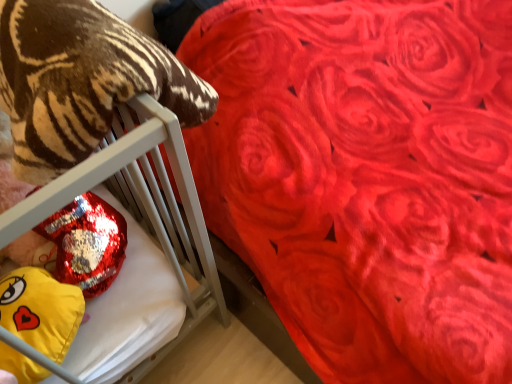
The width and height of the screenshot is (512, 384). What do you see at coordinates (41, 310) in the screenshot?
I see `yellow plush at left` at bounding box center [41, 310].

Describe the element at coordinates (143, 210) in the screenshot. The width and height of the screenshot is (512, 384). I see `shiny metallic pillow at left` at that location.

Find the location of a particular element. The width and height of the screenshot is (512, 384). shiny metallic pillow at left is located at coordinates point(143,210).

Measure the distance between point (188, 126) and camera.

The distance of point (188, 126) from camera is 34.29 inches.

The height and width of the screenshot is (384, 512). What are the coordinates of `yellow plush at left` in the screenshot? It's located at (41, 310).

Is point (49, 175) positioned in front of point (50, 278)?

Yes, point (49, 175) is in front of point (50, 278).

What's the angular difference between soft plush tiger at left and yellow plush at left's facing directions?

The angular difference between soft plush tiger at left and yellow plush at left is 1.88 degrees.

Which of these two, soft plush tiger at left or yellow plush at left, is smaller?

yellow plush at left is smaller.

Which object is further away from the camera taking this photo, soft plush tiger at left or yellow plush at left?

Positioned behind is yellow plush at left.

Considering the relative sizes of yellow plush at left and soft plush tiger at left in the image provided, is yellow plush at left bigger than soft plush tiger at left?

Actually, yellow plush at left might be smaller than soft plush tiger at left.

Is yellow plush at left wider or thinner than soft plush tiger at left?

In the image, yellow plush at left appears to be more narrow than soft plush tiger at left.

Based on the photo, considering the sizes of yellow plush at left and soft plush tiger at left in the image, is yellow plush at left taller or shorter than soft plush tiger at left?

Clearly, yellow plush at left is shorter compared to soft plush tiger at left.

Would you say yellow plush at left is inside or outside soft plush tiger at left?

yellow plush at left is not inside soft plush tiger at left, it's outside.

Between yellow plush at left and shiny metallic pillow at left, which one appears on the left side from the viewer's perspective?

Positioned to the left is shiny metallic pillow at left.

From a real-world perspective, is yellow plush at left beneath shiny metallic pillow at left?

Actually, yellow plush at left is physically above shiny metallic pillow at left in the real world.

Which object is wider, yellow plush at left or shiny metallic pillow at left?

shiny metallic pillow at left is wider.

Is shiny metallic pillow at left a part of yellow plush at left?

No, shiny metallic pillow at left is not surrounded by yellow plush at left.

Is shiny metallic pillow at left positioned beyond the bounds of soft plush tiger at left?

Yes.

From the image's perspective, which object appears higher, shiny metallic pillow at left or soft plush tiger at left?

soft plush tiger at left appears higher in the image.

Based on the photo, is shiny metallic pillow at left bigger or smaller than soft plush tiger at left?

Clearly, shiny metallic pillow at left is smaller in size than soft plush tiger at left.

Who is more distant, shiny metallic pillow at left or soft plush tiger at left?

Positioned behind is shiny metallic pillow at left.

Is soft plush tiger at left surrounding shiny metallic pillow at left?

No, soft plush tiger at left does not contain shiny metallic pillow at left.

Looking at this image, from the image's perspective, does soft plush tiger at left appear lower than shiny metallic pillow at left?

No, from the image's perspective, soft plush tiger at left is not below shiny metallic pillow at left.

Is soft plush tiger at left placed right next to shiny metallic pillow at left?

No, soft plush tiger at left is not making contact with shiny metallic pillow at left.

Who is bigger, soft plush tiger at left or shiny metallic pillow at left?

Bigger between the two is soft plush tiger at left.

Is shiny metallic pillow at left outside of yellow plush at left?

Yes.

Which point is more forward, (40, 199) or (75, 294)?

The point (40, 199) is closer to the camera.

In the image, is shiny metallic pillow at left on the left side or the right side of yellow plush at left?

Based on their positions, shiny metallic pillow at left is located to the left of yellow plush at left.

Locate an element on the screen. throw pillow on the left side of soft plush tiger at left is located at coordinates (41, 310).

You are a GUI agent. You are given a task and a screenshot of the screen. Output one action in this format:
    pyautogui.click(x=<x>, y=<y>)
    Task: Click on the animal that appears above the yellow plush at left (from a real-world perspective)
    The height and width of the screenshot is (384, 512).
    Given the screenshot: What is the action you would take?
    pyautogui.click(x=81, y=81)

When comparing their distances from yellow plush at left, does shiny metallic pillow at left or soft plush tiger at left seem further?

soft plush tiger at left is positioned further to the anchor yellow plush at left.

Looking at the image, which one is located further to soft plush tiger at left, yellow plush at left or shiny metallic pillow at left?

Among the two, yellow plush at left is located further to soft plush tiger at left.

Which object lies further to the anchor point yellow plush at left, soft plush tiger at left or shiny metallic pillow at left?

Among the two, soft plush tiger at left is located further to yellow plush at left.

Based on their spatial positions, is yellow plush at left or soft plush tiger at left closer to shiny metallic pillow at left?

soft plush tiger at left is positioned closer to the anchor shiny metallic pillow at left.

From the image, which object appears to be nearer to shiny metallic pillow at left, soft plush tiger at left or yellow plush at left?

The object closer to shiny metallic pillow at left is soft plush tiger at left.

From the image, which object appears to be nearer to soft plush tiger at left, shiny metallic pillow at left or yellow plush at left?

Based on the image, shiny metallic pillow at left appears to be nearer to soft plush tiger at left.

At what (x,y) coordinates should I click in order to perform the action: click on furniture that lies between soft plush tiger at left and yellow plush at left from top to bottom. Please return your answer as a coordinate pair (x, y). Image resolution: width=512 pixels, height=384 pixels. Looking at the image, I should click on (143, 210).